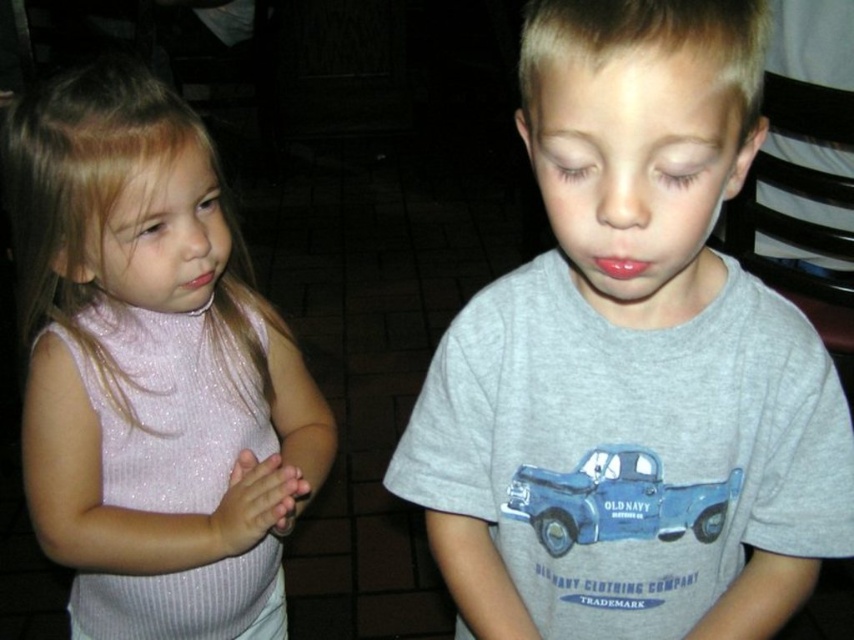
You are a tailor who needs to place both the gray cotton shirt at center and the blue matte truck at center onto a fabric panel. Which object should you place first if you want to ensure there is enough space for both?

The gray cotton shirt at center is larger in size than the blue matte truck at center, so you should place the gray cotton shirt at center first to ensure there is enough space for both.

You are a photographer trying to capture a closeup shot of both the gray cotton shirt at center and the blue matte truck at center. The camera you are using has a lens that can focus on objects within a 10 cm range. Can you fit both objects into the frame without moving the camera?

The gray cotton shirt at center is 10.05 centimeters from the blue matte truck at center. Since the distance between them is slightly more than the camera lens range of 10 cm, you cannot fit both objects into the frame without moving the camera.